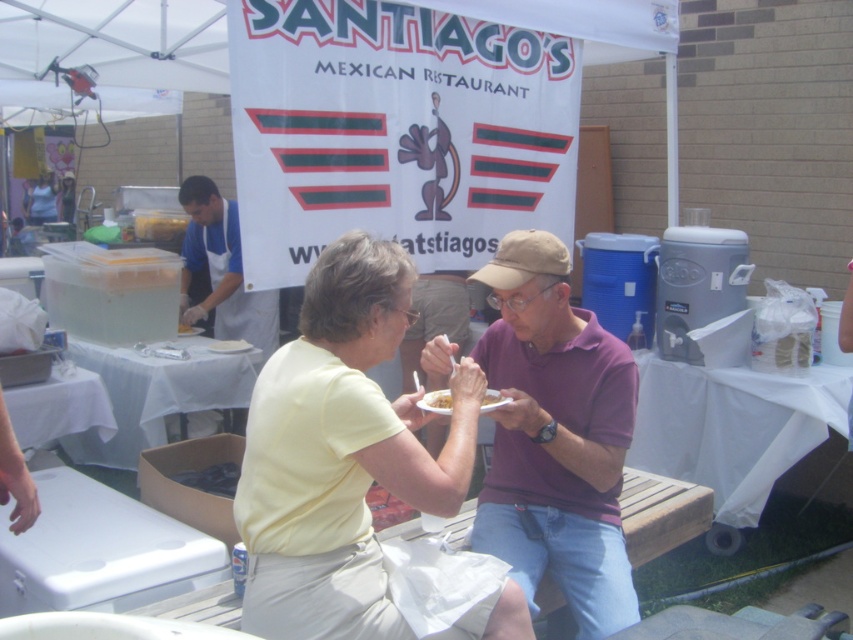
You are a photographer at the event and want to capture a photo of the purple cotton shirt at center and the white apron at left. Which one will appear closer to the camera in the photo?

The purple cotton shirt at center will appear closer to the camera in the photo because it is in front of the white apron at left according to the description.

You are a photographer at the event and want to capture a photo of the purple cotton shirt at center and the yellow matte plate at center. Which object should you focus on first if you want to ensure both are in frame without moving the camera?

Since the purple cotton shirt at center is taller than the yellow matte plate at center, you should focus on the purple cotton shirt at center first to ensure it fits within the frame.